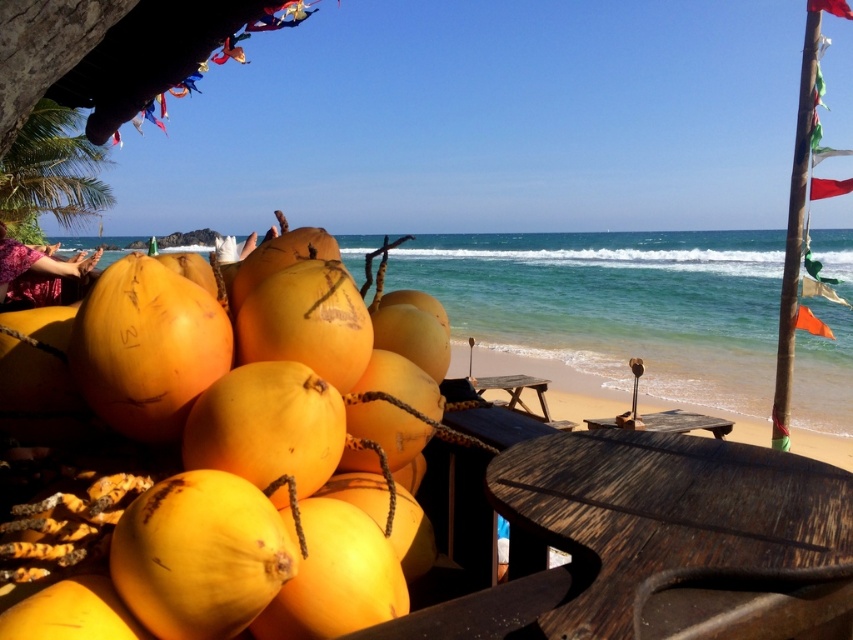
You are standing at the beach and want to take a photo of both the point at coordinates (318, 410) and the point at coordinates (799, 305). Which point will appear larger in your photo?

The point at coordinates (318, 410) will appear larger in the photo because it is closer to the camera than the point at coordinates (799, 305).

You are standing at the beach and want to take a photo of the green fabric flag at right. If your camera can focus up to 4 meters, will you be able to capture the flag clearly?

The green fabric flag at right is 4.18 meters away from the camera, which is beyond the camera focus range of 4 meters. Therefore, you won the flag clearly.